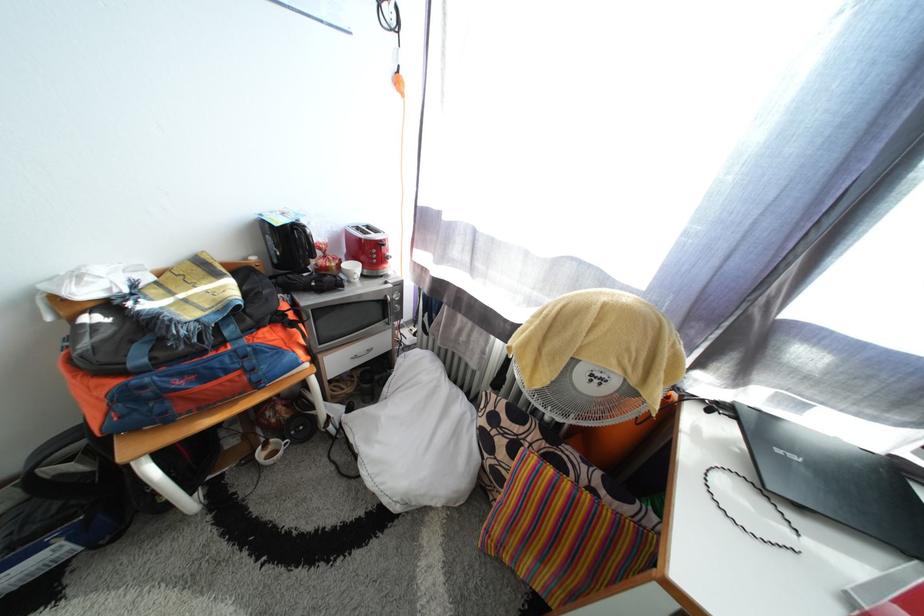
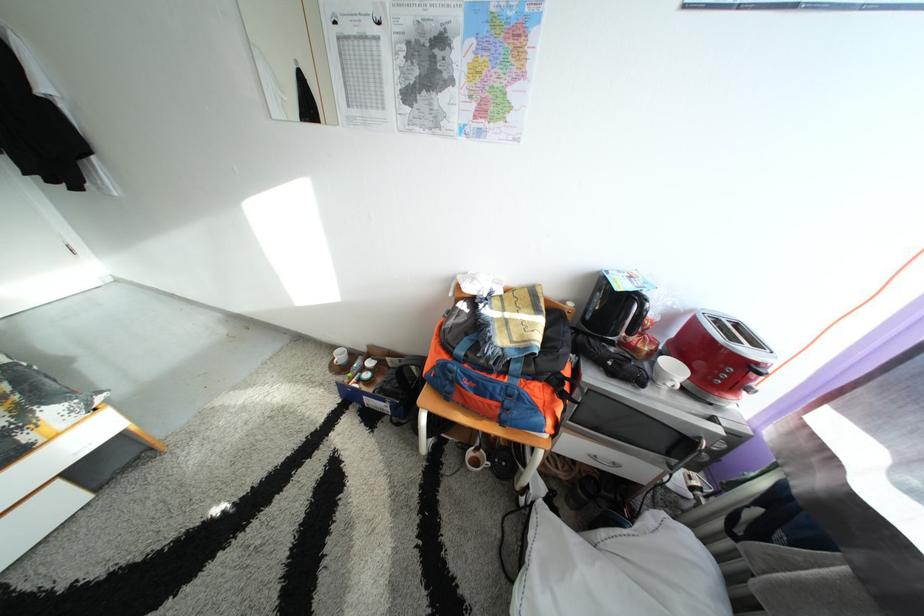
Find the pixel in the second image that matches (361,274) in the first image.

(683, 376)